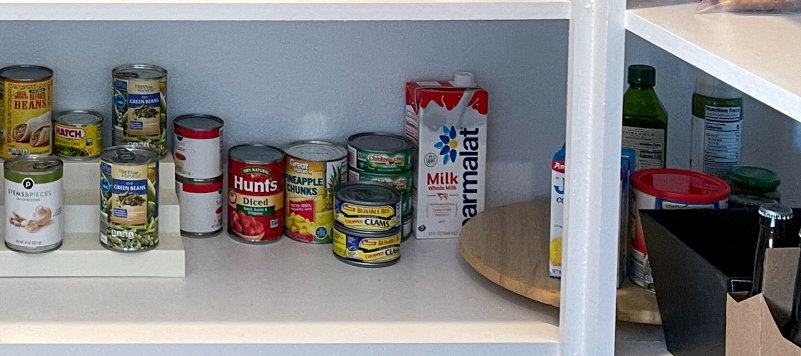
You are a GUI agent. You are given a task and a screenshot of the screen. Output one action in this format:
    pyautogui.click(x=<x>, y=<y>)
    Task: Click on the brown lazy susan
    The width and height of the screenshot is (801, 356).
    Given the screenshot: What is the action you would take?
    pyautogui.click(x=508, y=264)